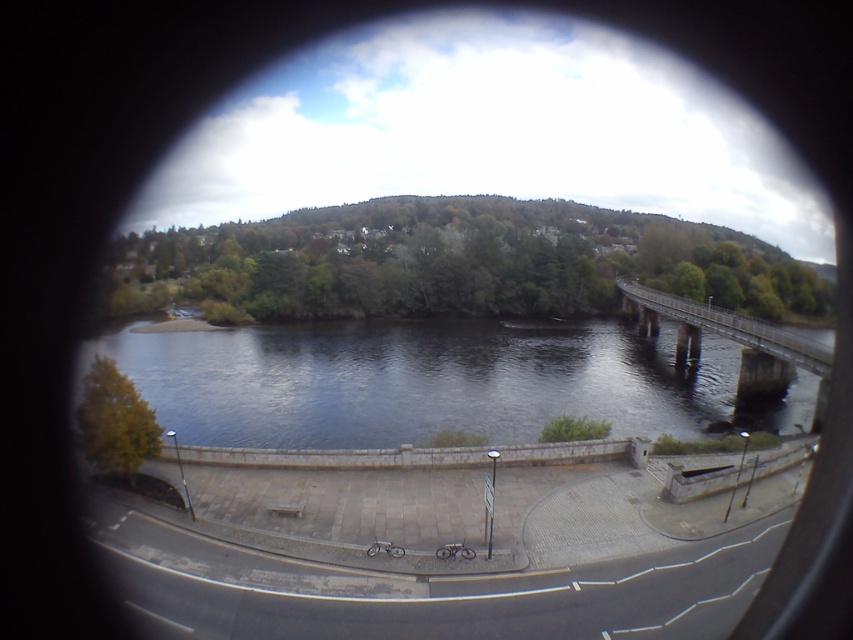
You are a photographer planning to take a picture of the dark blue water at center and the metallic gray bridge at right. Based on their positions, which object should appear to the left side in your photo?

The dark blue water at center appears to the left of the metallic gray bridge at right in the photo.